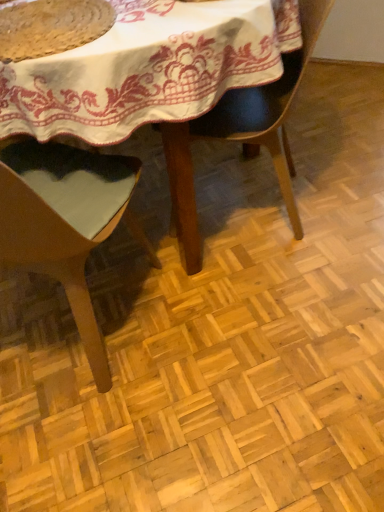
At what (x,y) coordinates should I click in order to perform the action: click on vacant space that's between matte black chair at center, the 2th chair in the left-to-right sequence, and light brown wood chair at center, which ranks as the 1th chair in left-to-right order. Please return your answer as a coordinate pair (x, y). The height and width of the screenshot is (512, 384). Looking at the image, I should click on coord(193,276).